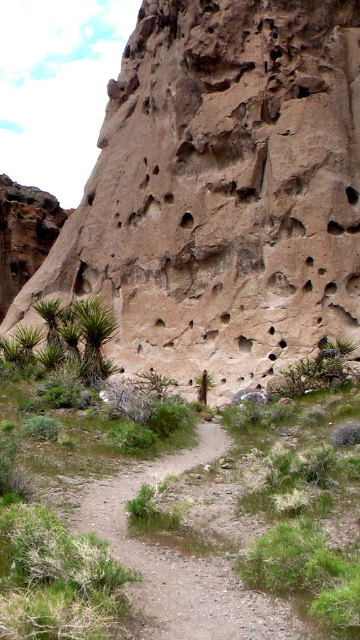
Question: Does dirt path at center appear over green spiky plant at lower left?

Choices:
 (A) yes
 (B) no

Answer: (B)

Question: Can you confirm if brown rough rock at center is thinner than green spiky plant at lower left?

Choices:
 (A) yes
 (B) no

Answer: (B)

Question: Does dirt path at center appear on the left side of green spiky plant at lower left?

Choices:
 (A) yes
 (B) no

Answer: (B)

Question: Which point is closer to the camera?

Choices:
 (A) brown rough rock at center
 (B) dirt path at center

Answer: (B)

Question: Which object appears farthest from the camera in this image?

Choices:
 (A) green spiky plant at lower left
 (B) dirt path at center
 (C) brown rough rock at center

Answer: (C)

Question: Which object is closer to the camera taking this photo?

Choices:
 (A) dirt path at center
 (B) brown rough rock at center

Answer: (A)